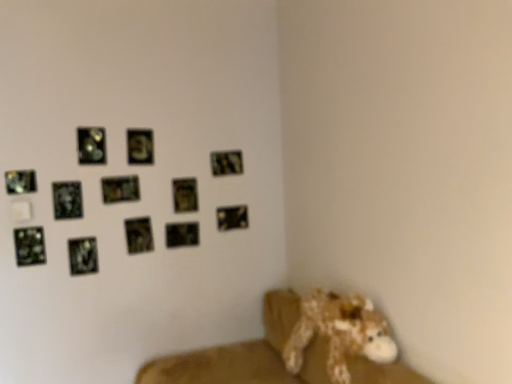
Question: Is metallic silver picture frame at center, positioned as the 6th picture frame in right-to-left order, bigger than metallic reflective picture frame at upper left, acting as the ninth picture frame starting from the right?

Choices:
 (A) no
 (B) yes

Answer: (B)

Question: From a real-world perspective, is metallic silver picture frame at center, the seventh picture frame when ordered from left to right, below metallic reflective picture frame at upper left, which is the 4th picture frame from left to right?

Choices:
 (A) no
 (B) yes

Answer: (A)

Question: Is metallic silver picture frame at center, the seventh picture frame when ordered from left to right, oriented away from metallic reflective picture frame at upper left, which is the 4th picture frame from left to right?

Choices:
 (A) no
 (B) yes

Answer: (A)

Question: From a real-world perspective, is metallic silver picture frame at center, the seventh picture frame when ordered from left to right, physically above metallic reflective picture frame at upper left, which is the 4th picture frame from left to right?

Choices:
 (A) yes
 (B) no

Answer: (A)

Question: Is metallic silver picture frame at center, the seventh picture frame when ordered from left to right, at the left side of metallic reflective picture frame at upper left, acting as the ninth picture frame starting from the right?

Choices:
 (A) yes
 (B) no

Answer: (B)

Question: From the image's perspective, is fuzzy brown stuffed animal at lower right positioned above or below metallic reflective picture frame at lower left, which is counted as the 11th picture frame, starting from the right?

Choices:
 (A) above
 (B) below

Answer: (B)

Question: From their relative heights in the image, would you say fuzzy brown stuffed animal at lower right is taller or shorter than metallic reflective picture frame at lower left, marked as the 2th picture frame in a left-to-right arrangement?

Choices:
 (A) tall
 (B) short

Answer: (A)

Question: Is fuzzy brown stuffed animal at lower right bigger or smaller than metallic reflective picture frame at lower left, which is counted as the 11th picture frame, starting from the right?

Choices:
 (A) small
 (B) big

Answer: (B)

Question: From a real-world perspective, relative to metallic reflective picture frame at lower left, which is counted as the 11th picture frame, starting from the right, is fuzzy brown stuffed animal at lower right vertically above or below?

Choices:
 (A) above
 (B) below

Answer: (B)

Question: Looking at the image, does metallic reflective picture frame at upper left, which appears as the 12th picture frame when viewed from the right, seem bigger or smaller compared to metallic reflective picture frame at upper left, acting as the ninth picture frame starting from the right?

Choices:
 (A) small
 (B) big

Answer: (A)

Question: From the image's perspective, is metallic reflective picture frame at upper left, which appears as the 12th picture frame when viewed from the right, located above or below metallic reflective picture frame at upper left, acting as the ninth picture frame starting from the right?

Choices:
 (A) below
 (B) above

Answer: (B)

Question: Is metallic reflective picture frame at upper left, which is the first picture frame from left to right, spatially inside metallic reflective picture frame at upper left, acting as the ninth picture frame starting from the right, or outside of it?

Choices:
 (A) inside
 (B) outside

Answer: (B)

Question: In terms of height, does metallic reflective picture frame at upper left, which is the first picture frame from left to right, look taller or shorter compared to metallic reflective picture frame at upper left, acting as the ninth picture frame starting from the right?

Choices:
 (A) short
 (B) tall

Answer: (A)

Question: From their relative heights in the image, would you say metallic silver picture frame at center, positioned as the 6th picture frame in right-to-left order, is taller or shorter than brown plush toy at lower right?

Choices:
 (A) short
 (B) tall

Answer: (A)

Question: Looking at their shapes, would you say metallic silver picture frame at center, positioned as the 6th picture frame in right-to-left order, is wider or thinner than brown plush toy at lower right?

Choices:
 (A) wide
 (B) thin

Answer: (B)